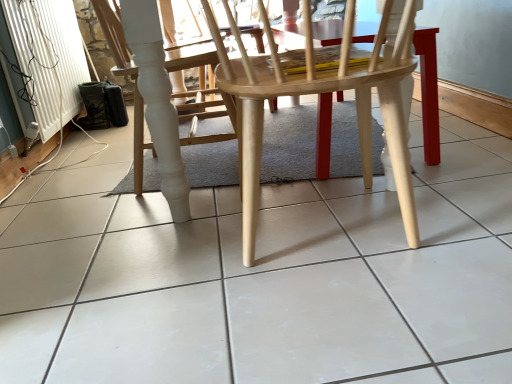
Question: Is natural wood chair at center, the second chair when ordered from left to right, smaller than white glossy tile at center?

Choices:
 (A) yes
 (B) no

Answer: (A)

Question: Is the position of natural wood chair at center, the first chair viewed from the front, more distant than that of white glossy tile at center?

Choices:
 (A) yes
 (B) no

Answer: (A)

Question: From a real-world perspective, is natural wood chair at center, the first chair viewed from the front, positioned under white glossy tile at center based on gravity?

Choices:
 (A) yes
 (B) no

Answer: (B)

Question: Is white glossy tile at center at the back of natural wood chair at center, the first chair viewed from the front?

Choices:
 (A) no
 (B) yes

Answer: (B)

Question: Are natural wood chair at center, placed as the second chair when sorted from back to front, and white glossy tile at center making contact?

Choices:
 (A) no
 (B) yes

Answer: (A)

Question: Does natural wood chair at center, the first chair viewed from the front, come in front of white glossy tile at center?

Choices:
 (A) yes
 (B) no

Answer: (B)

Question: Is white glossy chair at center, the 2th chair in the right-to-left sequence, not inside natural wood chair at center, the second chair when ordered from left to right?

Choices:
 (A) no
 (B) yes

Answer: (B)

Question: Can you confirm if white glossy chair at center, the first chair viewed from the back, is wider than natural wood chair at center, the first chair viewed from the front?

Choices:
 (A) no
 (B) yes

Answer: (A)

Question: Considering the relative positions of white glossy chair at center, arranged as the second chair when viewed from the front, and natural wood chair at center, placed as the second chair when sorted from back to front, in the image provided, is white glossy chair at center, arranged as the second chair when viewed from the front, to the left of natural wood chair at center, placed as the second chair when sorted from back to front, from the viewer's perspective?

Choices:
 (A) no
 (B) yes

Answer: (B)

Question: Can you confirm if white glossy chair at center, the 2th chair in the right-to-left sequence, is thinner than natural wood chair at center, the first chair viewed from the front?

Choices:
 (A) yes
 (B) no

Answer: (A)

Question: Is white glossy chair at center, the 2th chair in the right-to-left sequence, closer to camera compared to natural wood chair at center, marked as the first chair in a right-to-left arrangement?

Choices:
 (A) no
 (B) yes

Answer: (A)

Question: From the image's perspective, is white glossy chair at center, the first chair viewed from the back, on natural wood chair at center, the first chair viewed from the front?

Choices:
 (A) yes
 (B) no

Answer: (A)

Question: Is white glossy tile at center closer to the viewer compared to white glossy chair at center, arranged as the second chair when viewed from the front?

Choices:
 (A) no
 (B) yes

Answer: (B)